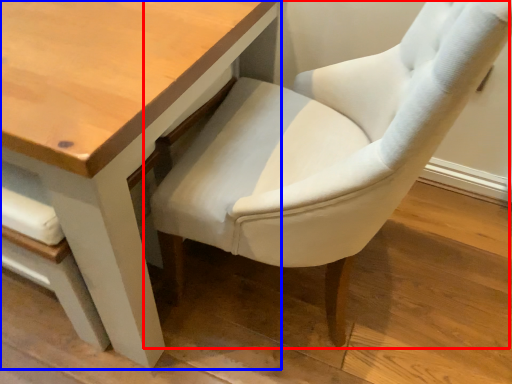
Question: Which of the following is the closest to the observer, chair (highlighted by a red box) or table (highlighted by a blue box)?

Choices:
 (A) chair
 (B) table

Answer: (A)